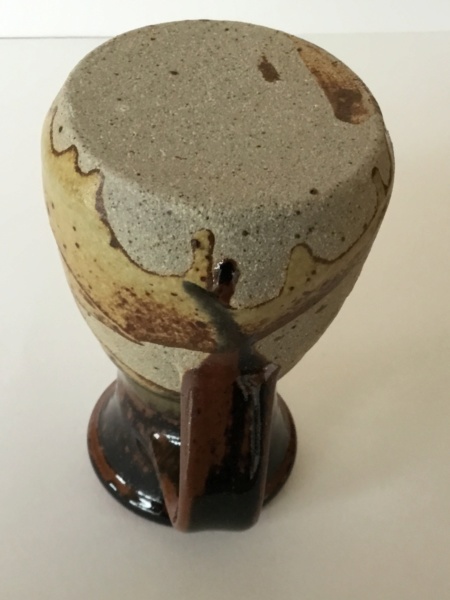
The width and height of the screenshot is (450, 600). I want to click on the top of pottery, so click(x=272, y=144).